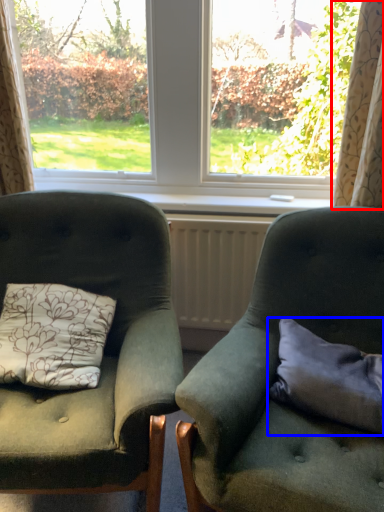
Question: Which point is further to the camera, curtain (highlighted by a red box) or pillow (highlighted by a blue box)?

Choices:
 (A) curtain
 (B) pillow

Answer: (A)